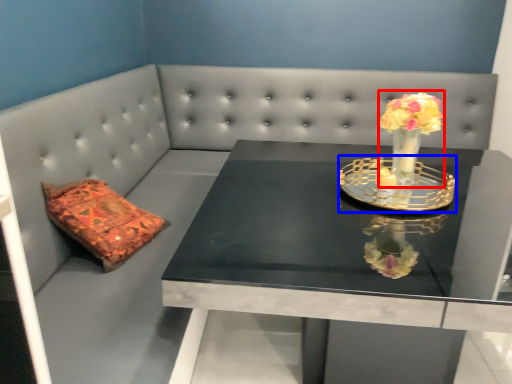
Question: Which object is closer to the camera taking this photo, floral arrangement (highlighted by a red box) or candle holder (highlighted by a blue box)?

Choices:
 (A) floral arrangement
 (B) candle holder

Answer: (B)